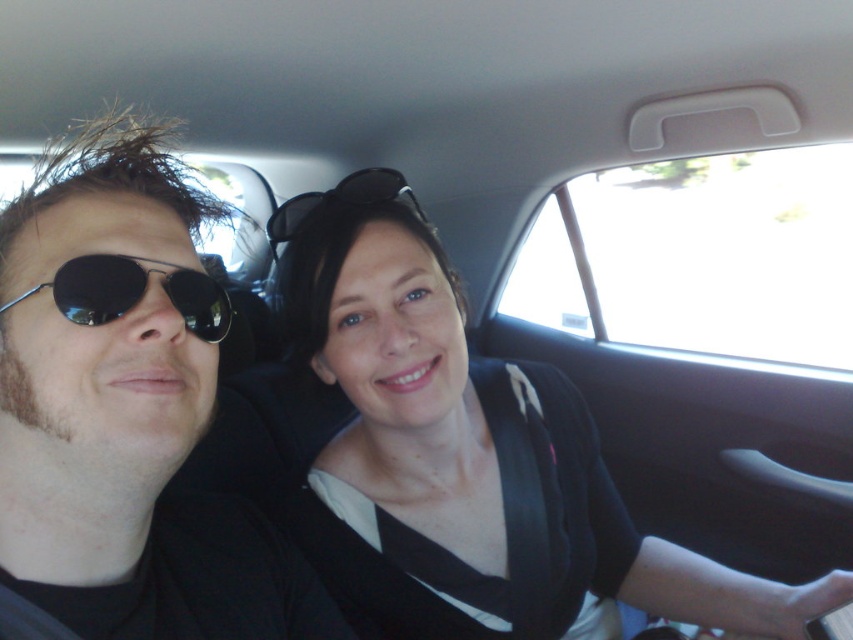
From the picture: You are a passenger in the car and want to grab the matte black sunglasses at left from your seat. Can you reach it without moving your seat?

The matte black sunglasses at left is 18.83 inches away from viewer. If your arm can reach 18.83 inches, then yes, you can reach it without moving your seat.

You are a fashion designer observing two pairs of sunglasses in the scene. The matte black sunglasses at left and the black reflective sunglasses at left. Which pair has a wider frame?

The matte black sunglasses at left has a wider frame than the black reflective sunglasses at left according to the description.

You are a passenger in the car and want to hand the matte black sunglasses at left to the driver who is wearing the matte black sunglasses at center. Can you directly hand them without moving your seat?

The matte black sunglasses at left is in front of matte black sunglasses at center, so you can directly hand them to the driver without moving your seat.